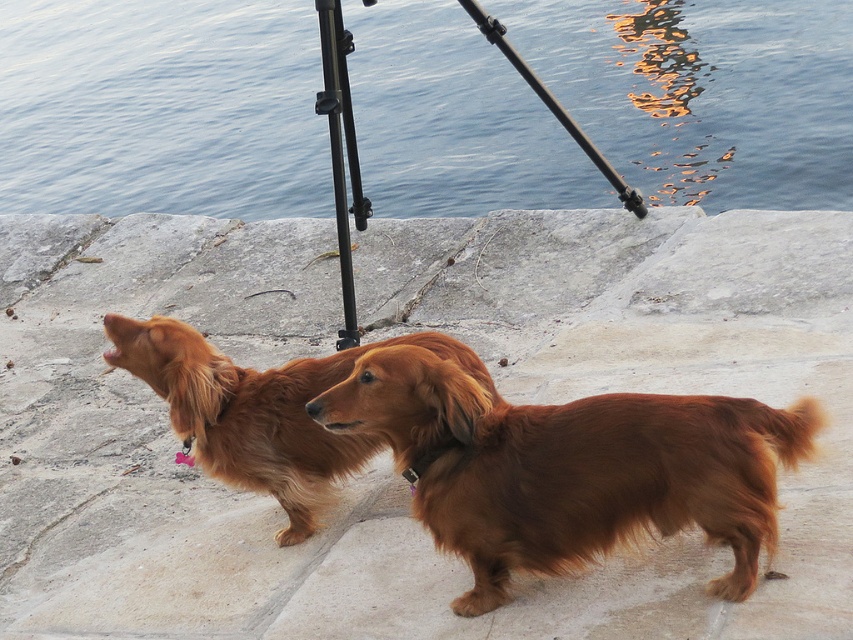
You are a photographer setting up a shot with the blue water at upper center and the brown furry dog at center. Which object occupies more horizontal space in the frame?

The brown furry dog at center occupies more horizontal space than the blue water at upper center since the blue water at upper center has a lesser width compared to brown furry dog at center.

You are a photographer setting up a tripod for a dog photo shoot. You notice the smooth concrete stone at center and the shiny brown fur at center. Which object is located above the other?

The smooth concrete stone at center is positioned over shiny brown fur at center.

You are standing at the origin point in the image. There is a blue water at upper center located at point (161, 108). If you want to walk towards the blue water at upper center, which direction should you move?

The blue water at upper center is located at point (161, 108). Since you are at the origin, you should move towards the upper center direction to reach it.